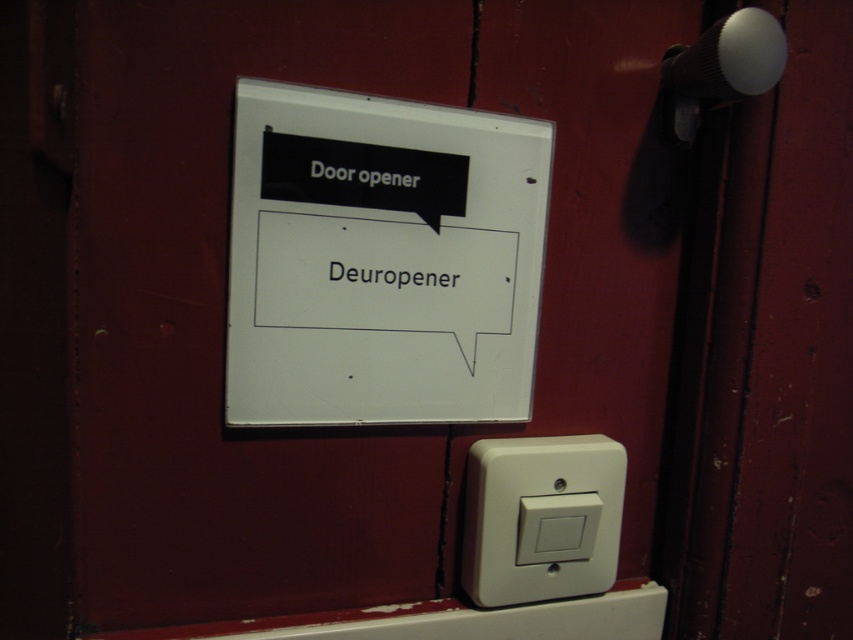
Can you confirm if white plastic switch at lower center is positioned to the left of white plastic door opener at upper center?

In fact, white plastic switch at lower center is to the right of white plastic door opener at upper center.

Between white plastic switch at lower center and white plastic door opener at upper center, which one is positioned lower?

white plastic switch at lower center is below.

Is point (531, 481) more distant than point (404, 186)?

Yes, it is behind point (404, 186).

This screenshot has width=853, height=640. Identify the location of white plastic switch at lower center. (541, 516).

Does white plastic switch at lower center have a greater width compared to black plastic deuropener at center?

Yes.

Consider the image. Measure the distance from white plastic switch at lower center to black plastic deuropener at center.

8.45 inches

Who is more forward, (584, 486) or (427, 285)?

Point (427, 285) is more forward.

Image resolution: width=853 pixels, height=640 pixels. What are the coordinates of `white plastic switch at lower center` in the screenshot? It's located at pyautogui.click(x=541, y=516).

Is point (375, 147) closer to camera compared to point (395, 276)?

That is True.

Can you confirm if white plastic sign at upper center is positioned below black plastic deuropener at center?

Incorrect, white plastic sign at upper center is not positioned below black plastic deuropener at center.

You are a GUI agent. You are given a task and a screenshot of the screen. Output one action in this format:
    pyautogui.click(x=<x>, y=<y>)
    Task: Click on the white plastic sign at upper center
    
    Given the screenshot: What is the action you would take?
    pos(381,260)